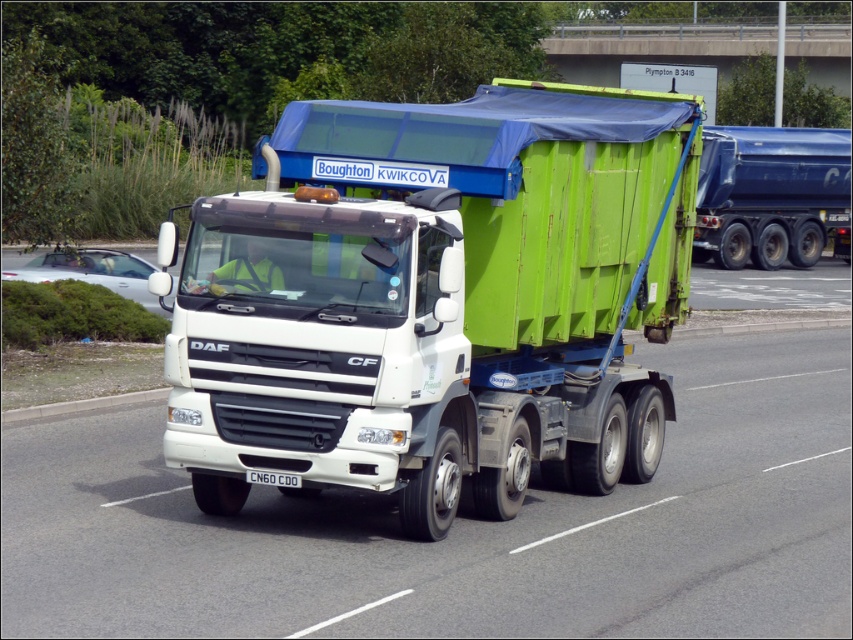
Question: Estimate the real-world distances between objects in this image. Which object is closer to the blue metallic trailer at right?

Choices:
 (A) green matte trailer truck at center
 (B) white plastic license plate at center

Answer: (B)

Question: Does green matte trailer truck at center appear on the left side of white plastic license plate at center?

Choices:
 (A) yes
 (B) no

Answer: (B)

Question: Which point is closer to the camera?

Choices:
 (A) click(x=799, y=180)
 (B) click(x=288, y=484)

Answer: (B)

Question: Does green matte trailer truck at center appear on the left side of white plastic license plate at center?

Choices:
 (A) yes
 (B) no

Answer: (B)

Question: Is green matte trailer truck at center to the right of white plastic license plate at center from the viewer's perspective?

Choices:
 (A) yes
 (B) no

Answer: (A)

Question: Which object is positioned closest to the white plastic license plate at center?

Choices:
 (A) blue metallic trailer at right
 (B) green matte trailer truck at center

Answer: (B)